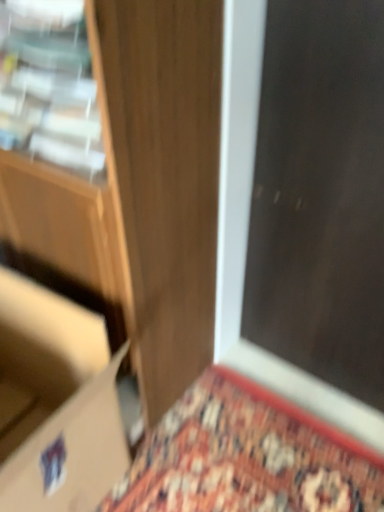
Question: Considering the relative sizes of matte cardboard box at lower left and dark wood screen door at upper right in the image provided, is matte cardboard box at lower left wider than dark wood screen door at upper right?

Choices:
 (A) yes
 (B) no

Answer: (B)

Question: Can you confirm if matte cardboard box at lower left is positioned to the right of dark wood screen door at upper right?

Choices:
 (A) yes
 (B) no

Answer: (B)

Question: From the image's perspective, does matte cardboard box at lower left appear higher than dark wood screen door at upper right?

Choices:
 (A) yes
 (B) no

Answer: (B)

Question: Is matte cardboard box at lower left taller than dark wood screen door at upper right?

Choices:
 (A) no
 (B) yes

Answer: (A)

Question: Does matte cardboard box at lower left have a larger size compared to dark wood screen door at upper right?

Choices:
 (A) yes
 (B) no

Answer: (B)

Question: Looking at the image, does matte cardboard box at lower left seem bigger or smaller compared to wooden door at center?

Choices:
 (A) small
 (B) big

Answer: (A)

Question: In terms of width, does matte cardboard box at lower left look wider or thinner when compared to wooden door at center?

Choices:
 (A) wide
 (B) thin

Answer: (B)

Question: Is matte cardboard box at lower left taller or shorter than wooden door at center?

Choices:
 (A) short
 (B) tall

Answer: (A)

Question: Is matte cardboard box at lower left spatially inside wooden door at center, or outside of it?

Choices:
 (A) inside
 (B) outside

Answer: (B)

Question: Considering the positions of matte cardboard box at lower left and dark wood screen door at upper right in the image, is matte cardboard box at lower left wider or thinner than dark wood screen door at upper right?

Choices:
 (A) thin
 (B) wide

Answer: (A)

Question: From the image's perspective, is matte cardboard box at lower left located above or below dark wood screen door at upper right?

Choices:
 (A) below
 (B) above

Answer: (A)

Question: Is point (62, 318) positioned closer to the camera than point (347, 343)?

Choices:
 (A) closer
 (B) farther

Answer: (A)

Question: Looking at the image, does matte cardboard box at lower left seem bigger or smaller compared to dark wood screen door at upper right?

Choices:
 (A) big
 (B) small

Answer: (B)

Question: Considering the positions of wooden door at center and dark wood screen door at upper right in the image, is wooden door at center wider or thinner than dark wood screen door at upper right?

Choices:
 (A) thin
 (B) wide

Answer: (A)

Question: From their relative heights in the image, would you say wooden door at center is taller or shorter than dark wood screen door at upper right?

Choices:
 (A) tall
 (B) short

Answer: (B)